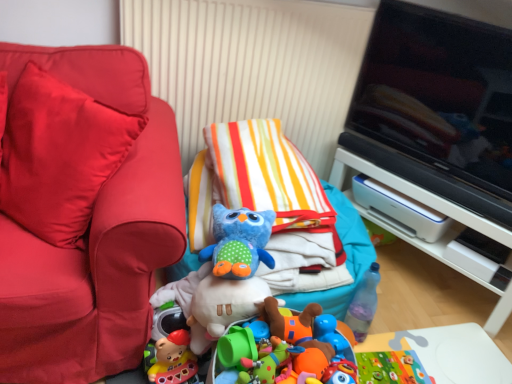
In order to face blue rubber duck at center, placed as the 1th toy when sorted from back to front, should I rotate leftwards or rightwards?

You should rotate right by 9.715 degrees.

What do you see at coordinates (82, 211) in the screenshot? I see `matte red couch at left, the 2th furniture positioned from the back` at bounding box center [82, 211].

This screenshot has width=512, height=384. I want to click on blue plush owl at center, acting as the first toy starting from the left, so click(239, 242).

Describe the element at coordinates (438, 106) in the screenshot. I see `black glossy television at upper right` at that location.

Find the location of `blue rubber duck at center, which is counted as the 2th toy, starting from the top`. blue rubber duck at center, which is counted as the 2th toy, starting from the top is located at coordinates (330, 335).

Is matte red couch at left, marked as the first furniture in a front-to-back arrangement, at the back of white plastic printer at right, the 1th furniture viewed from the right?

No, matte red couch at left, marked as the first furniture in a front-to-back arrangement, is not at the back of white plastic printer at right, the 1th furniture viewed from the right.

Between point (509, 294) and point (146, 295), which one is positioned in front?

The point (146, 295) is closer.

Is matte red couch at left, placed as the second furniture when sorted from right to left, a part of white plastic printer at right, the 1th furniture viewed from the right?

No, matte red couch at left, placed as the second furniture when sorted from right to left, is not surrounded by white plastic printer at right, the 1th furniture viewed from the right.

Considering the relative positions of white plastic printer at right, the 1th furniture viewed from the right, and matte red couch at left, placed as the second furniture when sorted from right to left, in the image provided, is white plastic printer at right, the 1th furniture viewed from the right, to the left of matte red couch at left, placed as the second furniture when sorted from right to left, from the viewer's perspective?

In fact, white plastic printer at right, the 1th furniture viewed from the right, is to the right of matte red couch at left, placed as the second furniture when sorted from right to left.

Is point (498, 88) positioned behind point (354, 204)?

No, it is in front of (354, 204).

Where is `television that appears above the white plastic printer at right, placed as the 1th furniture when sorted from back to front (from the image's perspective)`? The width and height of the screenshot is (512, 384). television that appears above the white plastic printer at right, placed as the 1th furniture when sorted from back to front (from the image's perspective) is located at coordinates (438, 106).

Is black glossy television at upper right taller than white plastic printer at right, placed as the 1th furniture when sorted from back to front?

Yes, black glossy television at upper right is taller than white plastic printer at right, placed as the 1th furniture when sorted from back to front.

In the scene shown: Measure the distance between black glossy television at upper right and white plastic printer at right, the second furniture positioned from the left.

They are 11.17 inches apart.

Who is smaller, blue rubber duck at center, which is counted as the 2th toy, starting from the top, or black glossy television at upper right?

blue rubber duck at center, which is counted as the 2th toy, starting from the top, is smaller.

In the scene shown: Is blue rubber duck at center, the 2th toy in the front-to-back sequence, positioned behind black glossy television at upper right?

That is True.

Is black glossy television at upper right at the back of blue rubber duck at center, placed as the 2th toy when sorted from left to right?

No, blue rubber duck at center, placed as the 2th toy when sorted from left to right,'s orientation is not away from black glossy television at upper right.

In the scene shown: From the image's perspective, is blue rubber duck at center, acting as the first toy starting from the right, positioned above or below black glossy television at upper right?

blue rubber duck at center, acting as the first toy starting from the right, is below black glossy television at upper right.

Is blue plush owl at center, placed as the 2th toy when sorted from back to front, closer to the viewer compared to white plastic printer at right, positioned as the 2th furniture in front-to-back order?

Yes, the depth of blue plush owl at center, placed as the 2th toy when sorted from back to front, is less than that of white plastic printer at right, positioned as the 2th furniture in front-to-back order.

Considering the points (230, 269) and (346, 191), which point is in front, point (230, 269) or point (346, 191)?

Positioned in front is point (230, 269).

Is blue plush owl at center, which is the first toy from front to back, to the left of white plastic printer at right, positioned as the 2th furniture in front-to-back order, from the viewer's perspective?

Correct, you'll find blue plush owl at center, which is the first toy from front to back, to the left of white plastic printer at right, positioned as the 2th furniture in front-to-back order.

I want to click on toy lying above the white plastic printer at right, the 1th furniture viewed from the right (from the image's perspective), so click(239, 242).

From the picture: From a real-world perspective, is matte red couch at left, which appears as the 1th furniture when viewed from the left, beneath blue plush owl at center, the first toy positioned from the top?

No.

Is matte red couch at left, placed as the second furniture when sorted from right to left, oriented towards blue plush owl at center, placed as the 2th toy when sorted from back to front?

No, matte red couch at left, placed as the second furniture when sorted from right to left, does not turn towards blue plush owl at center, placed as the 2th toy when sorted from back to front.

Are matte red couch at left, marked as the first furniture in a front-to-back arrangement, and blue plush owl at center, which is the second toy from right to left, located far from each other?

No.

From the image's perspective, which object appears higher, matte red couch at left, marked as the first furniture in a front-to-back arrangement, or blue plush owl at center, placed as the 2th toy when sorted from back to front?

matte red couch at left, marked as the first furniture in a front-to-back arrangement, appears higher in the image.

Is blue rubber duck at center, which is counted as the 2th toy, starting from the top, facing towards matte red couch at left, placed as the second furniture when sorted from right to left?

No, blue rubber duck at center, which is counted as the 2th toy, starting from the top, is not oriented towards matte red couch at left, placed as the second furniture when sorted from right to left.

From the image's perspective, would you say blue rubber duck at center, which is counted as the 2th toy, starting from the top, is shown under matte red couch at left, placed as the second furniture when sorted from right to left?

Correct, blue rubber duck at center, which is counted as the 2th toy, starting from the top, appears lower than matte red couch at left, placed as the second furniture when sorted from right to left, in the image.

Are blue rubber duck at center, the 2th toy in the front-to-back sequence, and matte red couch at left, which appears as the 1th furniture when viewed from the left, far apart?

blue rubber duck at center, the 2th toy in the front-to-back sequence, is near matte red couch at left, which appears as the 1th furniture when viewed from the left, not far away.

From a real-world perspective, which object stands above the other?

matte red couch at left, marked as the first furniture in a front-to-back arrangement.

Can you confirm if matte red couch at left, the 2th furniture positioned from the back, is positioned to the right of white plastic printer at right, the 1th furniture viewed from the right?

No, matte red couch at left, the 2th furniture positioned from the back, is not to the right of white plastic printer at right, the 1th furniture viewed from the right.

Does matte red couch at left, marked as the first furniture in a front-to-back arrangement, have a smaller size compared to white plastic printer at right, positioned as the 2th furniture in front-to-back order?

Actually, matte red couch at left, marked as the first furniture in a front-to-back arrangement, might be larger than white plastic printer at right, positioned as the 2th furniture in front-to-back order.

Is matte red couch at left, placed as the second furniture when sorted from right to left, far from white plastic printer at right, the second furniture positioned from the left?

matte red couch at left, placed as the second furniture when sorted from right to left, is far away from white plastic printer at right, the second furniture positioned from the left.

At what (x,y) coordinates should I click in order to perform the action: click on furniture directly beneath the matte red couch at left, which appears as the 1th furniture when viewed from the left (from a real-world perspective). Please return your answer as a coordinate pair (x, y). This screenshot has height=384, width=512. Looking at the image, I should click on (434, 209).

The image size is (512, 384). Find the location of `furniture behind the black glossy television at upper right`. furniture behind the black glossy television at upper right is located at coordinates (434, 209).

Which object lies further to the anchor point blue plush owl at center, the first toy positioned from the top, blue rubber duck at center, acting as the first toy starting from the right, or white plastic printer at right, positioned as the 2th furniture in front-to-back order?

white plastic printer at right, positioned as the 2th furniture in front-to-back order, is further to blue plush owl at center, the first toy positioned from the top.

Looking at the image, which one is located closer to blue plush owl at center, which is the second toy from right to left, blue rubber duck at center, acting as the first toy starting from the right, or black glossy television at upper right?

blue rubber duck at center, acting as the first toy starting from the right, lies closer to blue plush owl at center, which is the second toy from right to left, than the other object.

Estimate the real-world distances between objects in this image. Which object is closer to white plastic printer at right, placed as the 1th furniture when sorted from back to front, matte red couch at left, the 2th furniture positioned from the back, or blue rubber duck at center, acting as the first toy starting from the right?

blue rubber duck at center, acting as the first toy starting from the right, is positioned closer to the anchor white plastic printer at right, placed as the 1th furniture when sorted from back to front.

Considering their positions, is matte red couch at left, which appears as the 1th furniture when viewed from the left, positioned closer to blue rubber duck at center, the 2th toy in the front-to-back sequence, than white plastic printer at right, the 1th furniture viewed from the right?

matte red couch at left, which appears as the 1th furniture when viewed from the left, is positioned closer to the anchor blue rubber duck at center, the 2th toy in the front-to-back sequence.

Looking at the image, which one is located further to blue plush owl at center, acting as the first toy starting from the left, matte red couch at left, which appears as the 1th furniture when viewed from the left, or blue rubber duck at center, placed as the 2th toy when sorted from left to right?

matte red couch at left, which appears as the 1th furniture when viewed from the left.

Consider the image. Looking at the image, which one is located further to blue plush owl at center, placed as the 2th toy when sorted from back to front, matte red couch at left, the 2th furniture positioned from the back, or black glossy television at upper right?

black glossy television at upper right.

Considering their positions, is black glossy television at upper right positioned further to blue rubber duck at center, acting as the first toy starting from the right, than white plastic printer at right, positioned as the 2th furniture in front-to-back order?

The object further to blue rubber duck at center, acting as the first toy starting from the right, is black glossy television at upper right.

Estimate the real-world distances between objects in this image. Which object is closer to matte red couch at left, placed as the second furniture when sorted from right to left, blue rubber duck at center, placed as the 1th toy when sorted from back to front, or black glossy television at upper right?

Based on the image, blue rubber duck at center, placed as the 1th toy when sorted from back to front, appears to be nearer to matte red couch at left, placed as the second furniture when sorted from right to left.

The height and width of the screenshot is (384, 512). Identify the location of toy between blue plush owl at center, which is the second toy from right to left, and white plastic printer at right, placed as the 1th furniture when sorted from back to front, in the horizontal direction. (330, 335).

The height and width of the screenshot is (384, 512). In order to click on toy that lies between black glossy television at upper right and blue rubber duck at center, placed as the 1th toy when sorted from back to front, from top to bottom in this screenshot , I will do `click(239, 242)`.

At what (x,y) coordinates should I click in order to perform the action: click on furniture between blue plush owl at center, which is the first toy from front to back, and black glossy television at upper right from left to right. Please return your answer as a coordinate pair (x, y). Looking at the image, I should click on (434, 209).

Where is `toy situated between matte red couch at left, which appears as the 1th furniture when viewed from the left, and blue rubber duck at center, placed as the 1th toy when sorted from back to front, from left to right`? toy situated between matte red couch at left, which appears as the 1th furniture when viewed from the left, and blue rubber duck at center, placed as the 1th toy when sorted from back to front, from left to right is located at coordinates (239, 242).